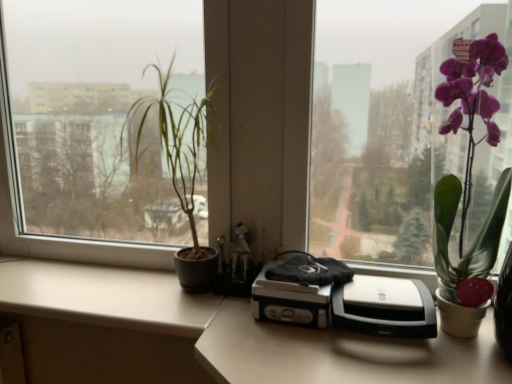
Question: Is silver/black plastic printer at center inside or outside of beige matte counter top at lower left?

Choices:
 (A) outside
 (B) inside

Answer: (A)

Question: Is silver/black plastic printer at center in front of or behind beige matte counter top at lower left in the image?

Choices:
 (A) behind
 (B) front

Answer: (B)

Question: Which object is positioned farthest from the silver/black plastic printer at center?

Choices:
 (A) beige matte counter top at lower left
 (B) purple glossy orchid at right, the 2th houseplant viewed from the left
 (C) green matte plant at left, positioned as the 1th houseplant in left-to-right order

Answer: (C)

Question: Based on their relative distances, which object is nearer to the silver/black plastic printer at center?

Choices:
 (A) beige matte counter top at lower left
 (B) green matte plant at left, which is the second houseplant from right to left
 (C) purple glossy orchid at right, the 2th houseplant viewed from the left

Answer: (C)